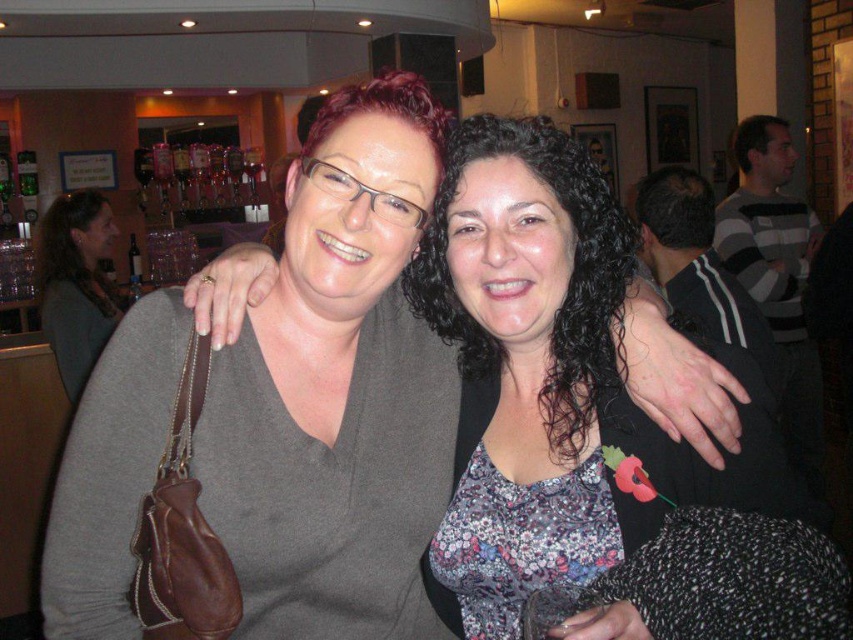
Question: Which point is closer to the camera?

Choices:
 (A) (360, 353)
 (B) (67, 195)

Answer: (A)

Question: Is matte gray sweater at center smaller than matte gray sweater at left?

Choices:
 (A) no
 (B) yes

Answer: (B)

Question: Which point is farther to the camera?

Choices:
 (A) matte gray sweater at center
 (B) matte gray sweater at left

Answer: (B)

Question: Can you confirm if matte gray sweater at center is positioned above matte gray sweater at left?

Choices:
 (A) yes
 (B) no

Answer: (B)

Question: Does matte gray sweater at center have a greater width compared to matte gray sweater at left?

Choices:
 (A) no
 (B) yes

Answer: (B)